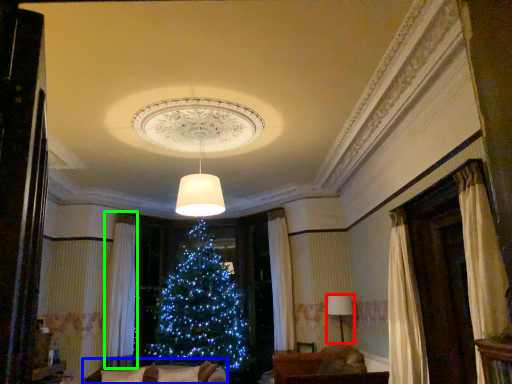
Question: Based on their relative distances, which object is nearer to lamp (highlighted by a red box)? Choose from couch (highlighted by a blue box) and curtain (highlighted by a green box).

Choices:
 (A) couch
 (B) curtain

Answer: (A)